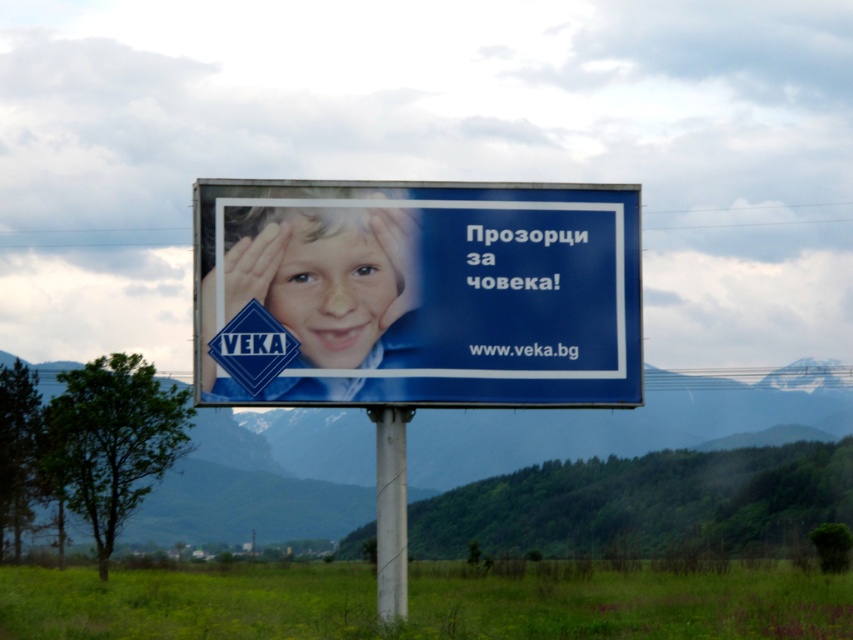
You are a painter standing 3 meters away from the billboard. You want to paint both the matte blue face at center and the white plastic pole at center. Can you reach both objects with your 2.5 meter long paintbrush?

The distance between the matte blue face at center and the white plastic pole at center is 2.36 meters. Since your paintbrush is 2.5 meters long, you can reach both objects as the distance between them is within the paintbrush length.

You are a painter who needs to paint the matte blue face at center and the white plastic pole at center. If you start from the ground, which object should you paint first?

The white plastic pole at center should be painted first since the matte blue face at center is above it, meaning the pole is lower and closer to the ground.

You are standing in a grassy field and see the blue glossy billboard at center. If you walk directly towards the billboard, will you be facing the same direction as the billboard?

The blue glossy billboard at center is located at point (426, 291), which means it is positioned centrally in the scene. Walking directly towards it would mean facing the billboard head on, so yes, you would be facing the same direction as the billboard.